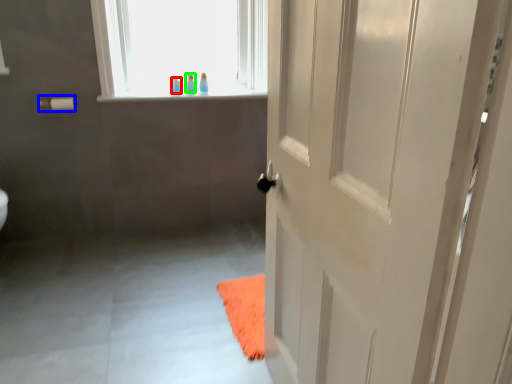
Question: Which object is the farthest from toiletry (highlighted by a red box)? Choose among these: towel bar (highlighted by a blue box) or toiletry (highlighted by a green box).

Choices:
 (A) towel bar
 (B) toiletry

Answer: (A)